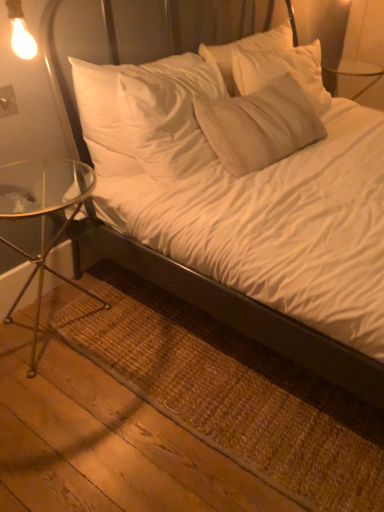
At what (x,y) coordinates should I click in order to perform the action: click on free space in front of clear glass table at left. Please return your answer as a coordinate pair (x, y). This screenshot has width=384, height=512. Looking at the image, I should click on (64, 407).